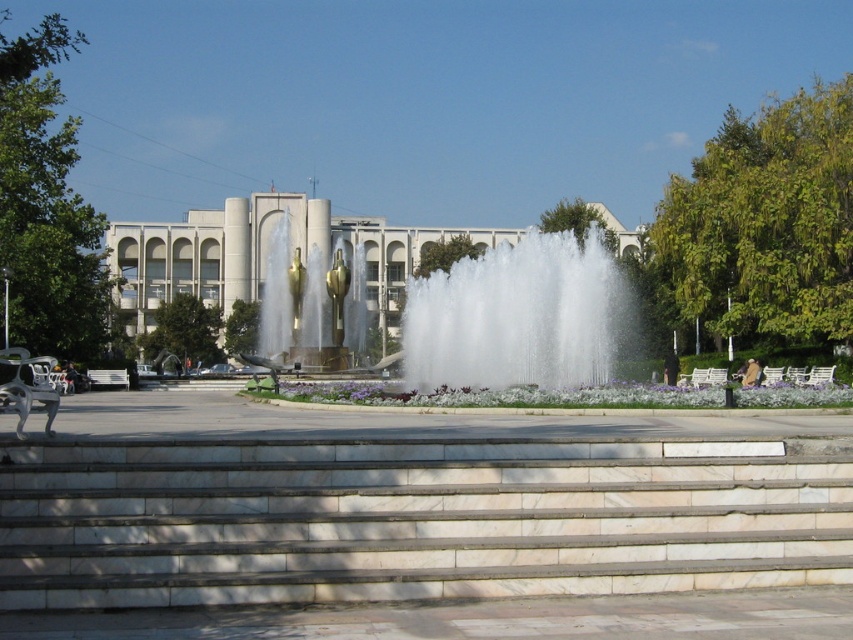
You are standing in the public square and want to take a photo of the fountain. The white frothy water at center and the gold polished water at center are both in your view. Which one appears closer to you in the photo?

The white frothy water at center appears closer because it is in front of the gold polished water at center.

You are a tourist standing at the edge of the public square. You want to take a photo of the white marble stairs at center and the gold polished water at center. Which object should you focus on first if you want to capture both in a single frame without moving the camera?

The white marble stairs at center is smaller than the gold polished water at center, so you should focus on the gold polished water at center first to ensure it fills the frame adequately while still capturing the smaller stairs in the shot.